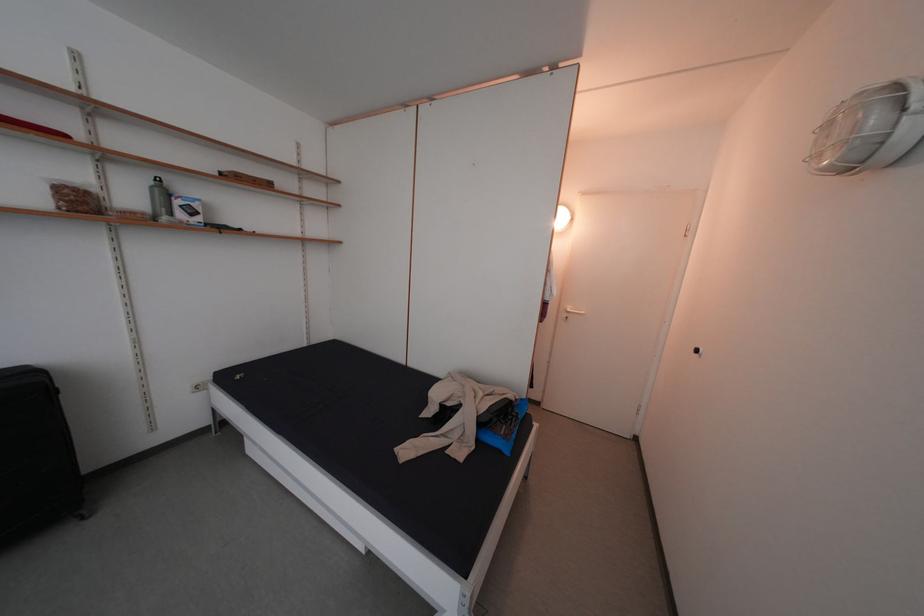
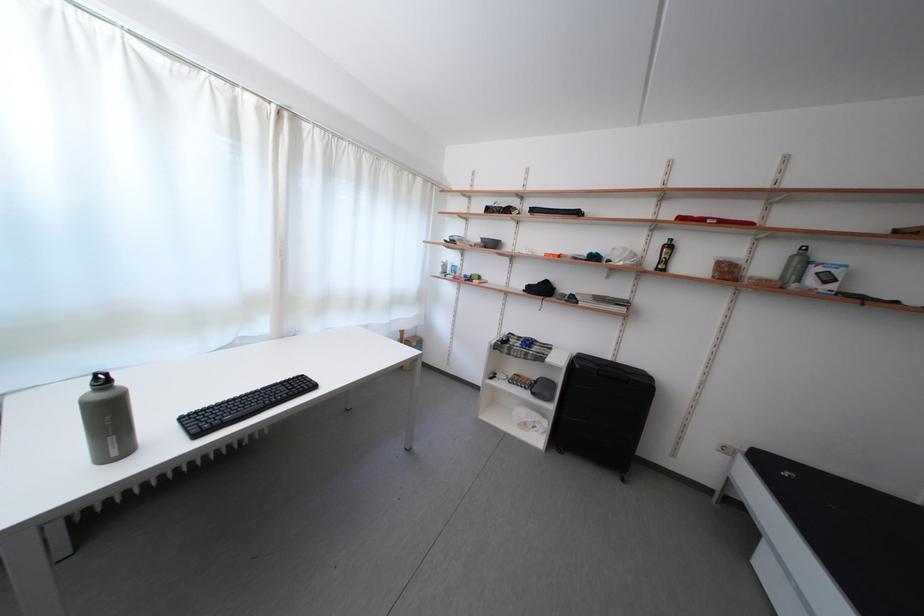
Find the pixel in the second image that matches [91,209] in the first image.

(736, 278)